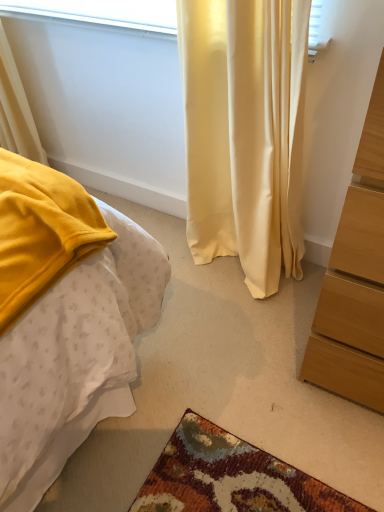
This screenshot has height=512, width=384. Find the location of `free space in front of satin yellow curtain at center`. free space in front of satin yellow curtain at center is located at coordinates (231, 343).